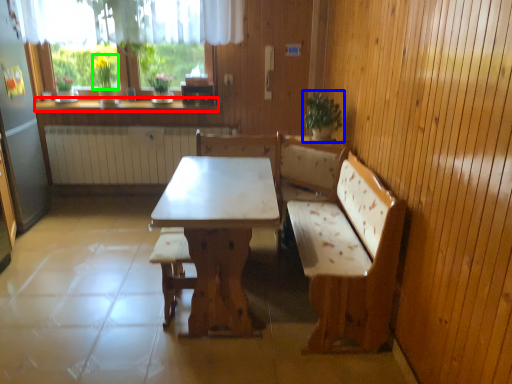
Question: Based on their relative distances, which object is farther from counter top (highlighted by a red box)? Choose from houseplant (highlighted by a blue box) and plant (highlighted by a green box).

Choices:
 (A) houseplant
 (B) plant

Answer: (A)